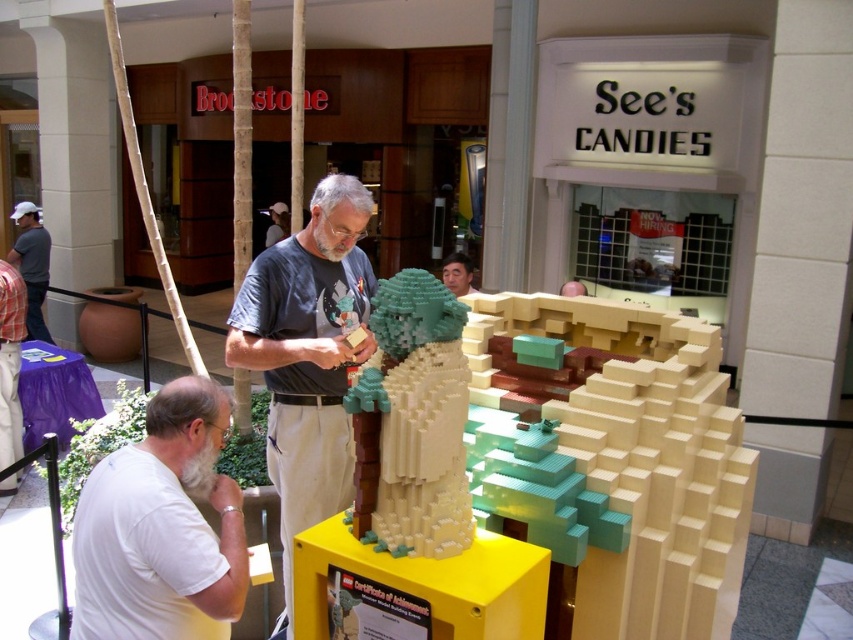
Question: Can you confirm if white matte shirt at lower left is smaller than white cotton shirt at left?

Choices:
 (A) yes
 (B) no

Answer: (A)

Question: Is white matte shirt at lower left below smooth gray shirt at center?

Choices:
 (A) yes
 (B) no

Answer: (A)

Question: Does smooth gray shirt at center appear over matte gray shirt at center?

Choices:
 (A) no
 (B) yes

Answer: (B)

Question: Which object is farther from the camera taking this photo?

Choices:
 (A) green matte lego tree at center
 (B) matte gray shirt at center
 (C) white cotton shirt at left
 (D) white matte shirt at lower left

Answer: (C)

Question: Which point appears closest to the camera in this image?

Choices:
 (A) (318, 481)
 (B) (569, 285)

Answer: (A)

Question: Which object appears closest to the camera in this image?

Choices:
 (A) white cotton shirt at left
 (B) gray t-shirt at center
 (C) green matte lego tree at center

Answer: (C)